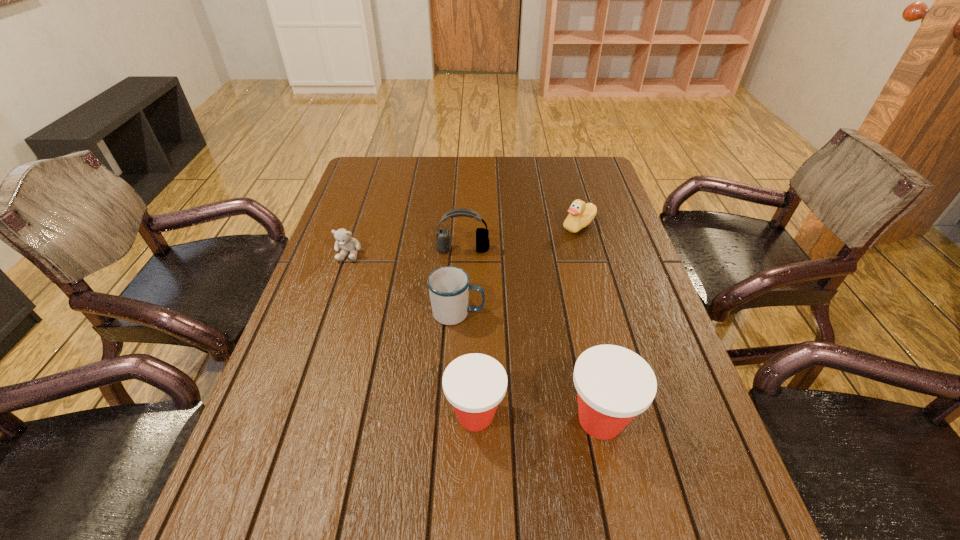
The image size is (960, 540). In order to click on the shorter Dixie cup in this screenshot , I will do `click(474, 384)`.

Locate an element on the screen. the taller Dixie cup is located at coordinates pyautogui.click(x=614, y=384).

The height and width of the screenshot is (540, 960). Identify the location of the farthest object. (580, 215).

The height and width of the screenshot is (540, 960). What are the coordinates of `headset` in the screenshot? It's located at (442, 235).

At what (x,y) coordinates should I click in order to perform the action: click on teddy bear. Please return your answer as a coordinate pair (x, y). Looking at the image, I should click on (343, 237).

Identify the location of mug. (448, 286).

This screenshot has height=540, width=960. Identify the location of free space located on the left of the shorter Dixie cup. (392, 415).

This screenshot has height=540, width=960. I want to click on free space located on the left of the right Dixie cup, so click(530, 420).

I want to click on blank area located 0.150m at the beak of the farthest object, so 514,226.

Identify the location of vacant region located 0.050m at the beak of the farthest object. Image resolution: width=960 pixels, height=540 pixels. (545, 226).